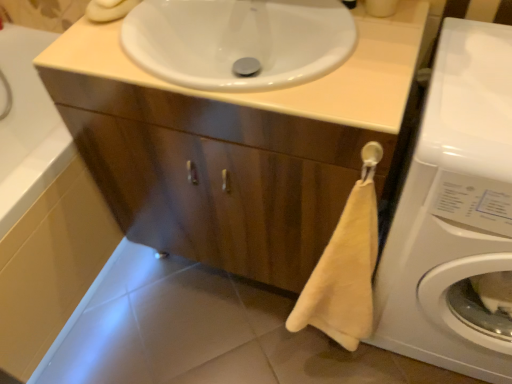
Question: Based on their sizes in the image, would you say white glossy washing machine at lower right is bigger or smaller than white glossy sink at upper center?

Choices:
 (A) big
 (B) small

Answer: (A)

Question: From the image's perspective, is white glossy washing machine at lower right positioned above or below white glossy sink at upper center?

Choices:
 (A) above
 (B) below

Answer: (B)

Question: Based on their relative distances, which object is nearer to the white glossy bath at lower left?

Choices:
 (A) wooden cabinet at center
 (B) white glossy washing machine at lower right
 (C) white glossy tile at lower center
 (D) white glossy sink at upper center

Answer: (A)

Question: Which object is positioned farthest from the white glossy tile at lower center?

Choices:
 (A) white glossy washing machine at lower right
 (B) white glossy sink at upper center
 (C) white glossy bath at lower left
 (D) wooden cabinet at center

Answer: (B)